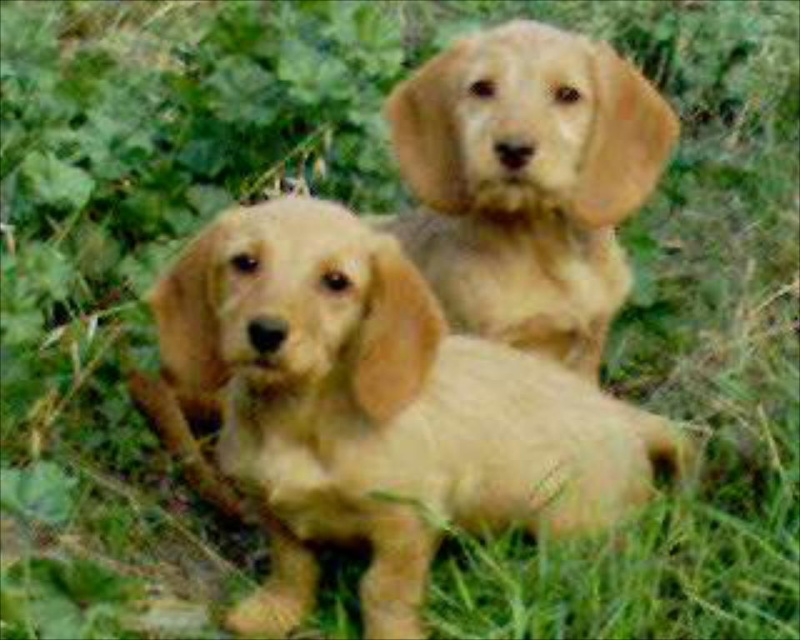
Question: Which object is closer to the camera taking this photo?

Choices:
 (A) golden fur puppy at center
 (B) golden fur dog at upper center

Answer: (A)

Question: Is golden fur puppy at center closer to the viewer compared to golden fur dog at upper center?

Choices:
 (A) yes
 (B) no

Answer: (A)

Question: Can you confirm if golden fur puppy at center is smaller than golden fur dog at upper center?

Choices:
 (A) yes
 (B) no

Answer: (B)

Question: Which of the following is the closest to the observer?

Choices:
 (A) golden fur dog at upper center
 (B) golden fur puppy at center

Answer: (B)

Question: Is golden fur puppy at center positioned at the back of golden fur dog at upper center?

Choices:
 (A) no
 (B) yes

Answer: (A)